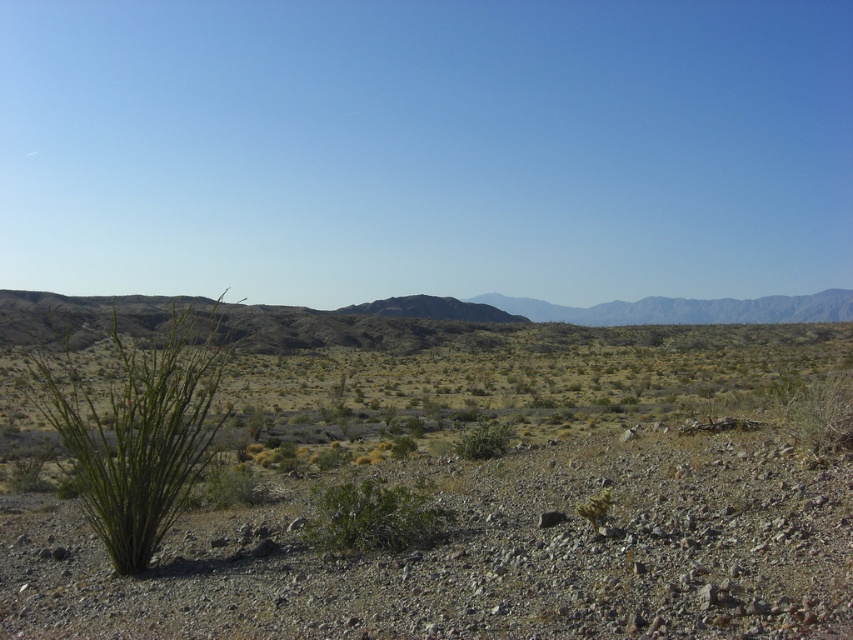
Question: Can you confirm if green leafy bush at center is bigger than green spiky bush at lower right?

Choices:
 (A) yes
 (B) no

Answer: (A)

Question: Can you confirm if green shrub at center is positioned above green spiny plant at left?

Choices:
 (A) no
 (B) yes

Answer: (A)

Question: Can you confirm if green shrub at center is thinner than green leafy bush at center?

Choices:
 (A) no
 (B) yes

Answer: (A)

Question: Which object appears closest to the camera in this image?

Choices:
 (A) green shrub at center
 (B) green spiny plant at left
 (C) green spiky bush at lower right

Answer: (A)

Question: Which point is farther to the camera?

Choices:
 (A) green spiny plant at left
 (B) green spiky bush at lower right
 (C) green leafy bush at center

Answer: (C)

Question: Which of the following is the closest to the observer?

Choices:
 (A) (430, 531)
 (B) (218, 566)
 (C) (595, 499)

Answer: (C)